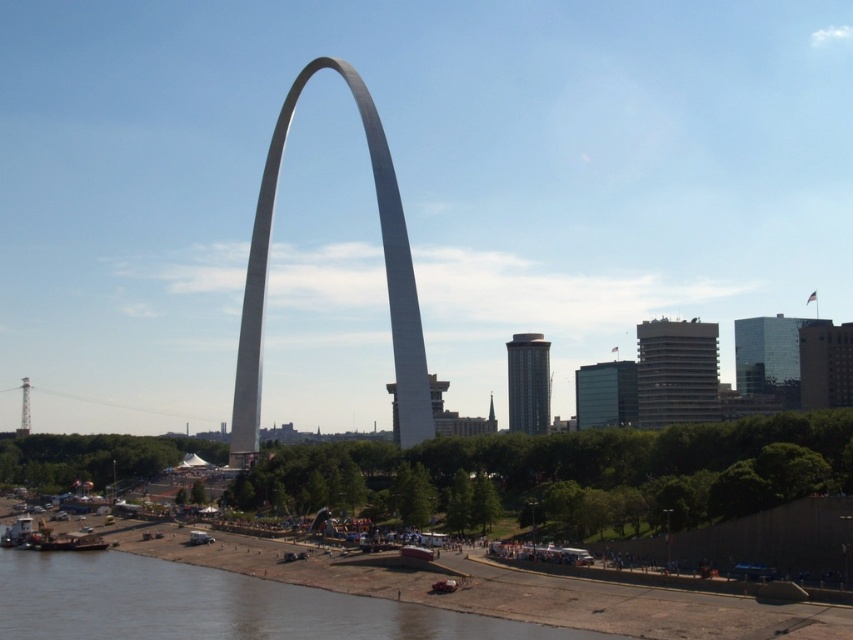
Question: Can you confirm if brown sedimentary river at lower center is wider than white polished concrete arch at center?

Choices:
 (A) no
 (B) yes

Answer: (B)

Question: Which point is farther to the camera?

Choices:
 (A) white polished concrete arch at center
 (B) brown sedimentary river at lower center

Answer: (A)

Question: Does brown sedimentary river at lower center appear over white polished concrete arch at center?

Choices:
 (A) no
 (B) yes

Answer: (A)

Question: Is brown sedimentary river at lower center to the right of white polished concrete arch at center from the viewer's perspective?

Choices:
 (A) no
 (B) yes

Answer: (A)

Question: Which point is farther from the camera taking this photo?

Choices:
 (A) pyautogui.click(x=239, y=387)
 (B) pyautogui.click(x=80, y=604)

Answer: (A)

Question: Which point is closer to the camera?

Choices:
 (A) white polished concrete arch at center
 (B) brown sedimentary river at lower center

Answer: (B)